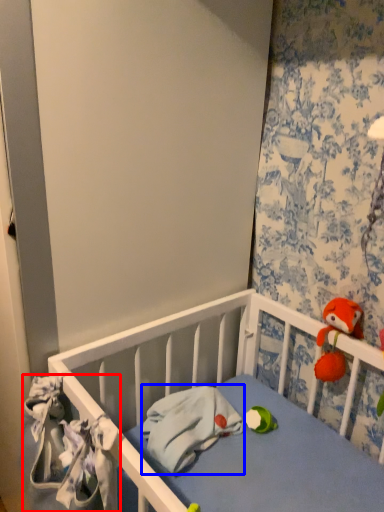
Question: Which object appears closest to the camera in this image, material (highlighted by a red box) or material (highlighted by a blue box)?

Choices:
 (A) material
 (B) material

Answer: (A)